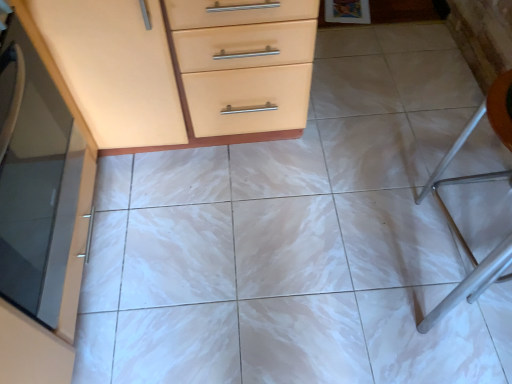
In order to click on vacant space in between orange plastic folding chair at right and matte wood chest of drawers at upper left, marked as the 1th chest of drawers in a bottom-to-top arrangement in this screenshot , I will do `click(385, 245)`.